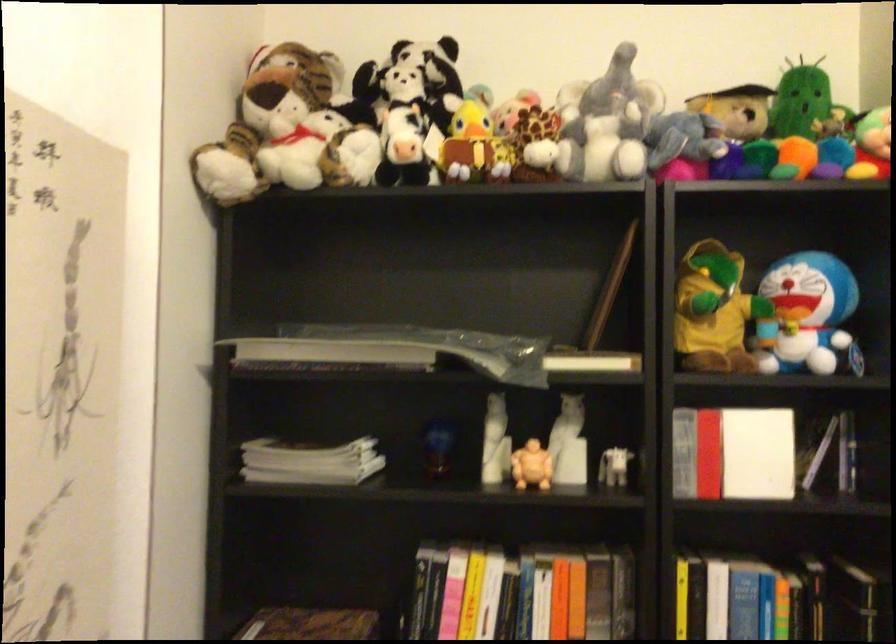
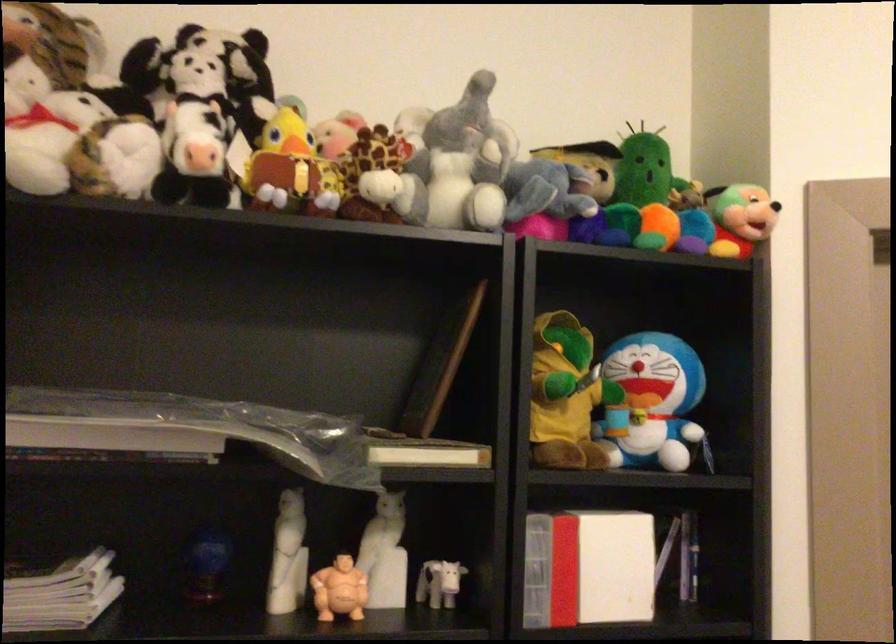
In the second image, find the point that corresponds to the point at 613,467 in the first image.

(438, 583)